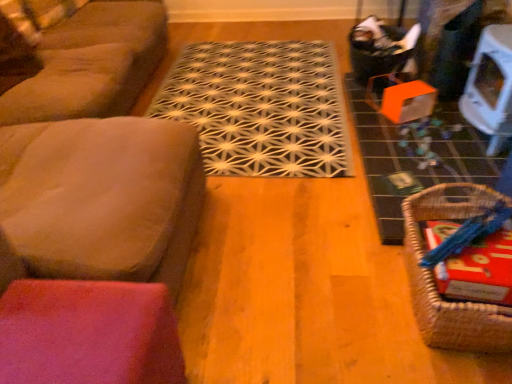
Question: Looking at the image, does suede-like brown couch at left seem bigger or smaller compared to woven brown basket at lower right?

Choices:
 (A) small
 (B) big

Answer: (B)

Question: Is suede-like brown couch at left situated inside woven brown basket at lower right or outside?

Choices:
 (A) outside
 (B) inside

Answer: (A)

Question: Which is farther from the white glossy table at upper right?

Choices:
 (A) woven brown basket at lower right
 (B) suede-like brown couch at left
 (C) suede-like brown couch at left
 (D) black woven mat at center

Answer: (C)

Question: Considering the real-world distances, which object is farthest from the black woven mat at center?

Choices:
 (A) suede-like brown couch at left
 (B) woven brown basket at lower right
 (C) white glossy table at upper right
 (D) suede-like brown couch at left

Answer: (B)